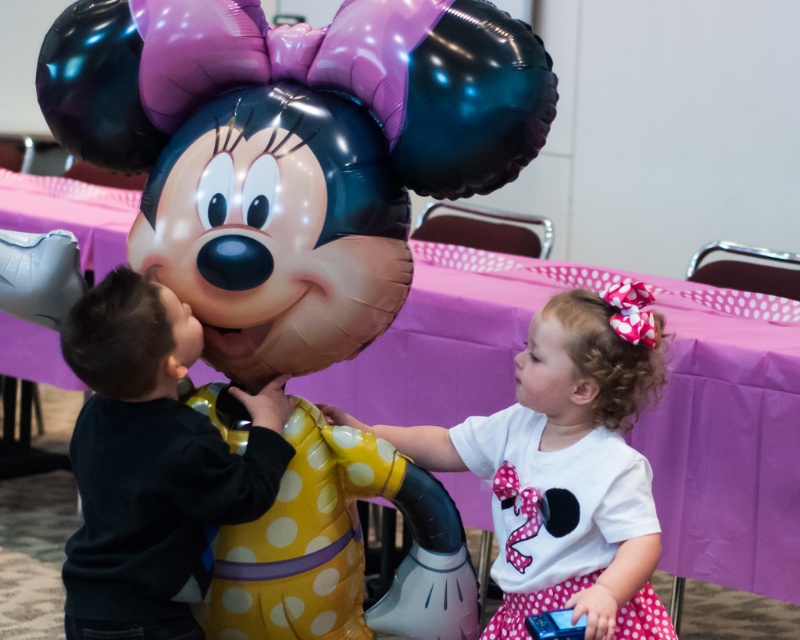
Who is more distant from viewer, (120, 358) or (396, 440)?

Point (396, 440)

At what (x,y) coordinates should I click in order to perform the action: click on black matte shirt at left. Please return your answer as a coordinate pair (x, y). Looking at the image, I should click on (152, 465).

The height and width of the screenshot is (640, 800). What are the coordinates of `black matte shirt at left` in the screenshot? It's located at (152, 465).

Which is more to the left, glossy metallic balloon at upper center or white matte shirt at center?

glossy metallic balloon at upper center is more to the left.

Identify the location of glossy metallic balloon at upper center. The height and width of the screenshot is (640, 800). (306, 80).

You are a GUI agent. You are given a task and a screenshot of the screen. Output one action in this format:
    pyautogui.click(x=<x>, y=<y>)
    Task: Click on the glossy metallic balloon at upper center
    
    Given the screenshot: What is the action you would take?
    pyautogui.click(x=306, y=80)

Image resolution: width=800 pixels, height=640 pixels. What are the coordinates of `glossy metallic balloon at upper center` in the screenshot? It's located at (306, 80).

Can you confirm if glossy metallic balloon at upper center is thinner than black matte shirt at left?

In fact, glossy metallic balloon at upper center might be wider than black matte shirt at left.

At what (x,y) coordinates should I click in order to perform the action: click on glossy metallic balloon at upper center. Please return your answer as a coordinate pair (x, y). Looking at the image, I should click on (306, 80).